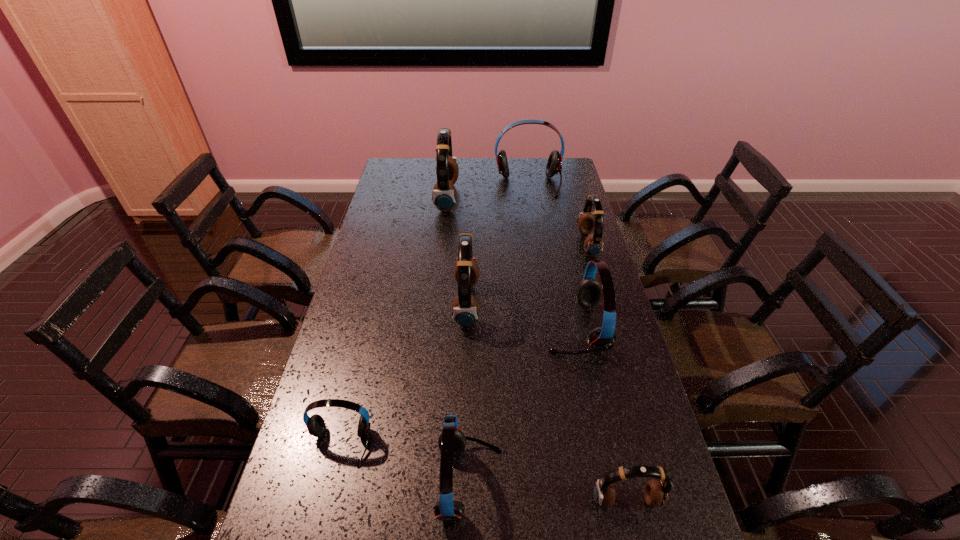
Identify the location of the biggest brown headset. The image size is (960, 540). (444, 196).

You are a GUI agent. You are given a task and a screenshot of the screen. Output one action in this format:
    pyautogui.click(x=<x>, y=<y>)
    Task: Click on the leftmost brown headset
    
    Given the screenshot: What is the action you would take?
    pyautogui.click(x=444, y=196)

Image resolution: width=960 pixels, height=540 pixels. What are the coordinates of `the farthest red headset` in the screenshot? It's located at (554, 164).

The width and height of the screenshot is (960, 540). What are the coordinates of `the third brown headset from right to left` in the screenshot? It's located at (465, 309).

In order to click on the second biggest brown headset in this screenshot , I will do click(465, 309).

Identify the location of the second farthest red headset. (589, 292).

Where is `the third farthest headset`? the third farthest headset is located at coordinates (587, 221).

Locate an element on the screen. The image size is (960, 540). the sixth nearest object is located at coordinates (587, 221).

The height and width of the screenshot is (540, 960). Find the location of `the second red headset from left to right`. the second red headset from left to right is located at coordinates (451, 442).

Locate an element on the screen. This screenshot has width=960, height=540. the nearest brown headset is located at coordinates (655, 493).